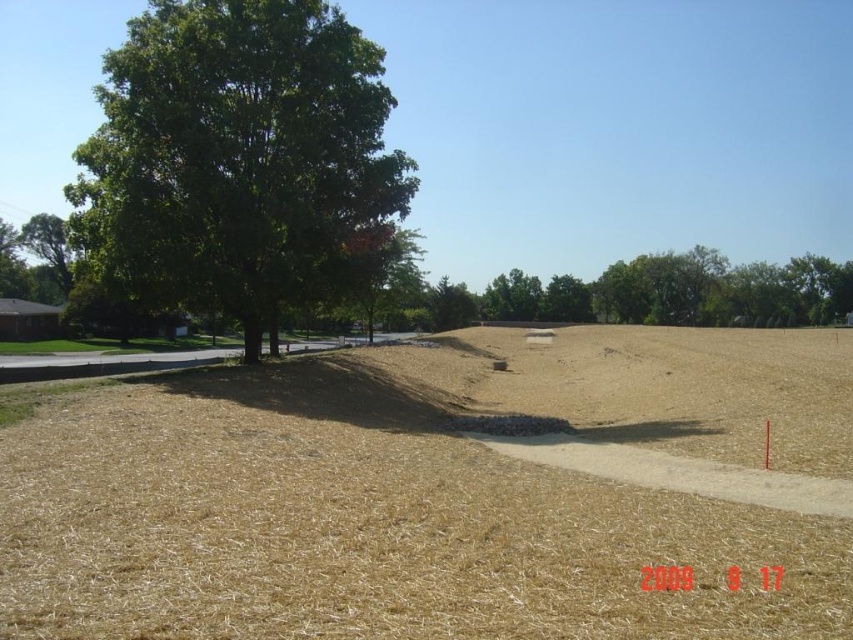
Consider the image. You are a gardener planning to water the brown dry grass at center and the green leafy tree at center. Which object is closer to the ground?

The brown dry grass at center is located below the green leafy tree at center, so the brown dry grass at center is closer to the ground.

You are a gardener planning to plant new flowers in the brown dry grass at center and the green leafy tree at left. Considering their sizes, which area would require more seeds to cover adequately?

The brown dry grass at center has a larger size compared to the green leafy tree at left, so it would require more seeds to cover adequately.

You are a delivery robot with a 2 meter wide package. You need to navigate from the tree to the pathway. Can you pass through the brown dry grass at center without the package getting stuck?

The distance between the tree and the pathway is 5.84 meters. Since the package is 2 meters wide, there is enough space for the robot to navigate through the brown dry grass at center without the package getting stuck.